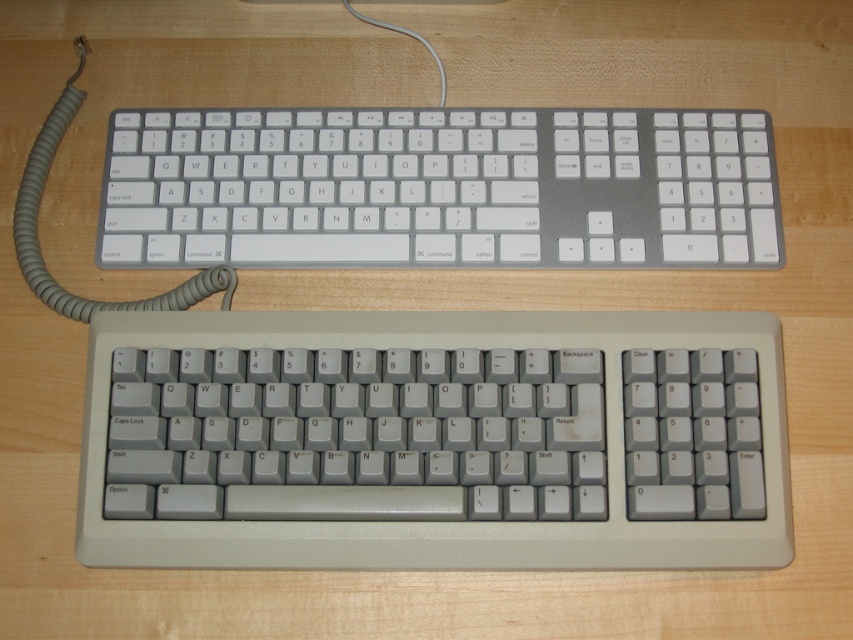
You are looking at two keyboards on a desk. You see a point at coordinate point (x=299, y=236) and another at point (x=28, y=173). Which point is closer to you?

Point (x=299, y=236) is closer to the viewer than point (x=28, y=173).